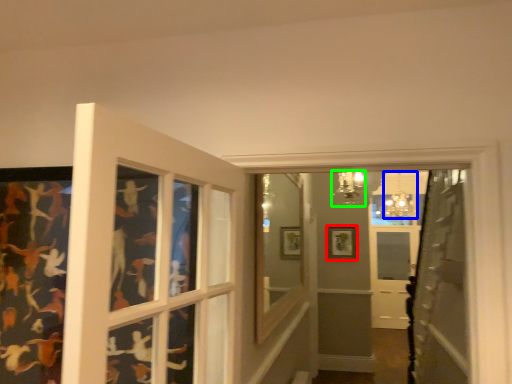
Question: Which object is the farthest from picture frame (highlighted by a red box)? Choose among these: light fixture (highlighted by a blue box) or light fixture (highlighted by a green box).

Choices:
 (A) light fixture
 (B) light fixture

Answer: (B)